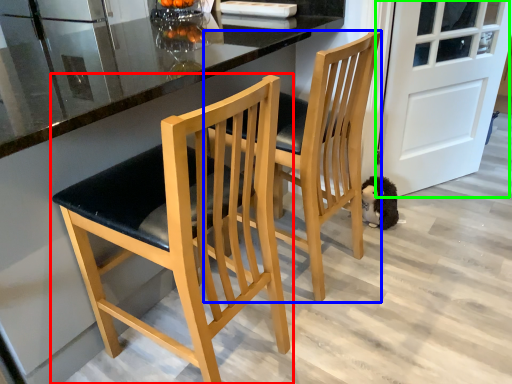
Question: Estimate the real-world distances between objects in this image. Which object is farther from chair (highlighted by a red box), chair (highlighted by a blue box) or door (highlighted by a green box)?

Choices:
 (A) chair
 (B) door

Answer: (B)